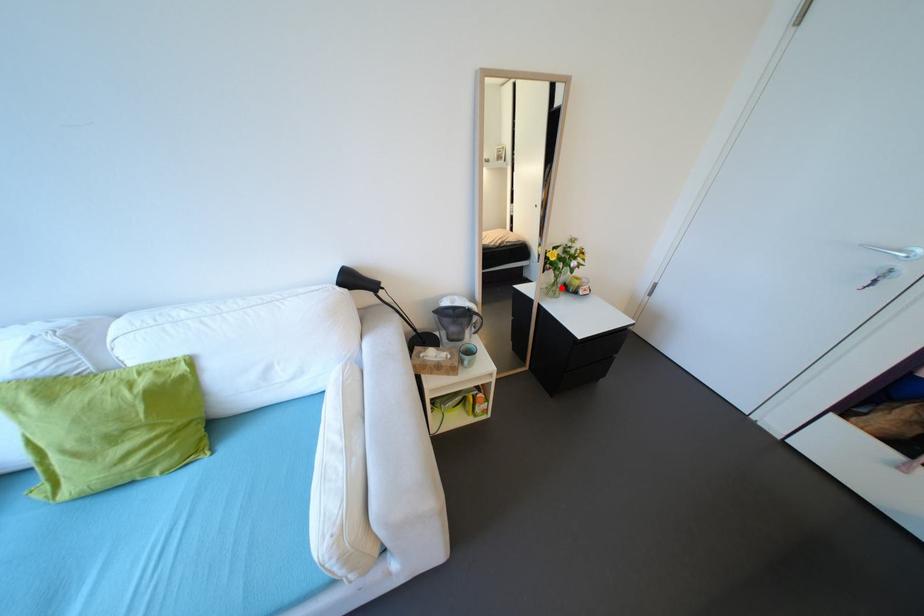
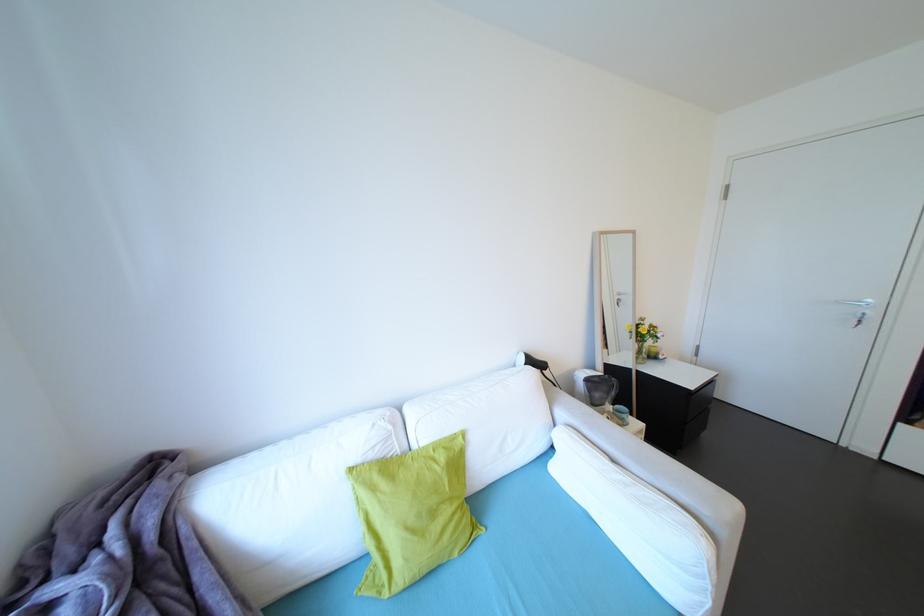
Find the pixel in the second image that matches the highlighted location in the first image.

(648, 355)